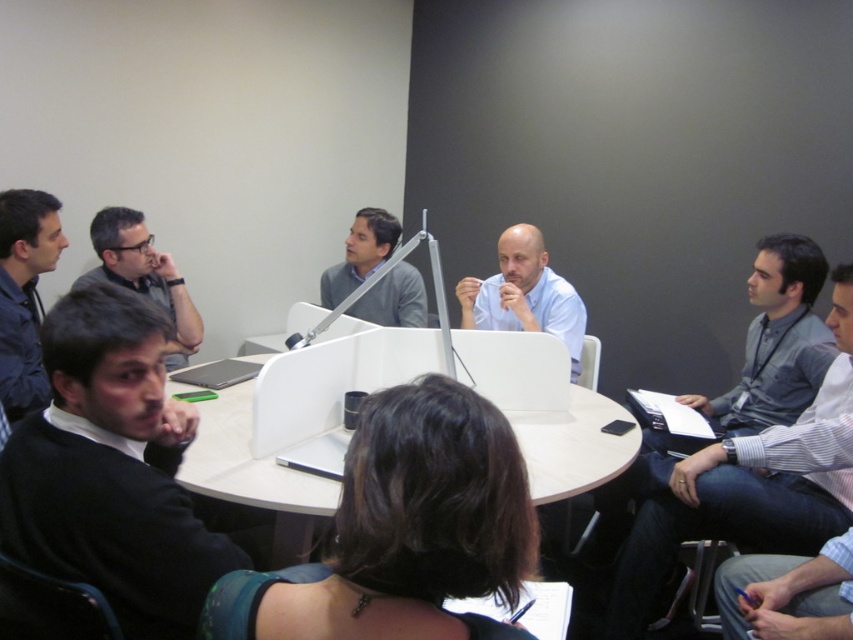
Question: Can you confirm if black sweater at lower left is positioned to the right of light blue shirt at center?

Choices:
 (A) yes
 (B) no

Answer: (B)

Question: Which point is farther to the camera?

Choices:
 (A) gray shirt at right
 (B) black sweater at lower left
 (C) light blue shirt at center
 (D) gray striped shirt at right

Answer: (C)

Question: Does dark blue shirt at left have a larger size compared to gray matte sweater at center?

Choices:
 (A) yes
 (B) no

Answer: (B)

Question: Is matte black glasses at upper left to the right of gray matte sweater at center from the viewer's perspective?

Choices:
 (A) yes
 (B) no

Answer: (B)

Question: Based on their relative distances, which object is farther from the gray matte sweater at center?

Choices:
 (A) matte black glasses at upper left
 (B) gray shirt at right

Answer: (B)

Question: Which point is farther from the camera taking this photo?

Choices:
 (A) (334, 268)
 (B) (119, 220)

Answer: (A)